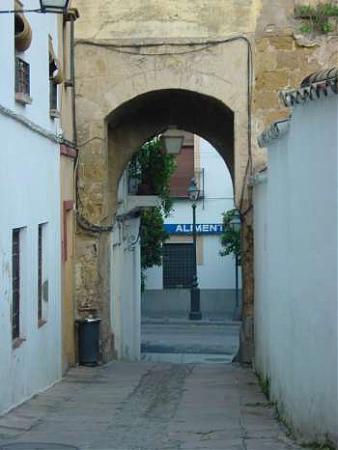
At what (x,y) coordinates should I click in order to perform the action: click on cords. Please return your answer as a coordinate pair (x, y). Image resolution: width=338 pixels, height=450 pixels. Looking at the image, I should click on [x=188, y=44].